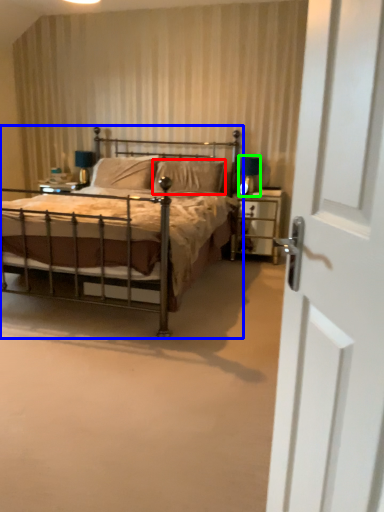
Question: Considering the real-world distances, which object is closest to pillow (highlighted by a red box)? bed (highlighted by a blue box) or table lamp (highlighted by a green box).

Choices:
 (A) bed
 (B) table lamp

Answer: (B)